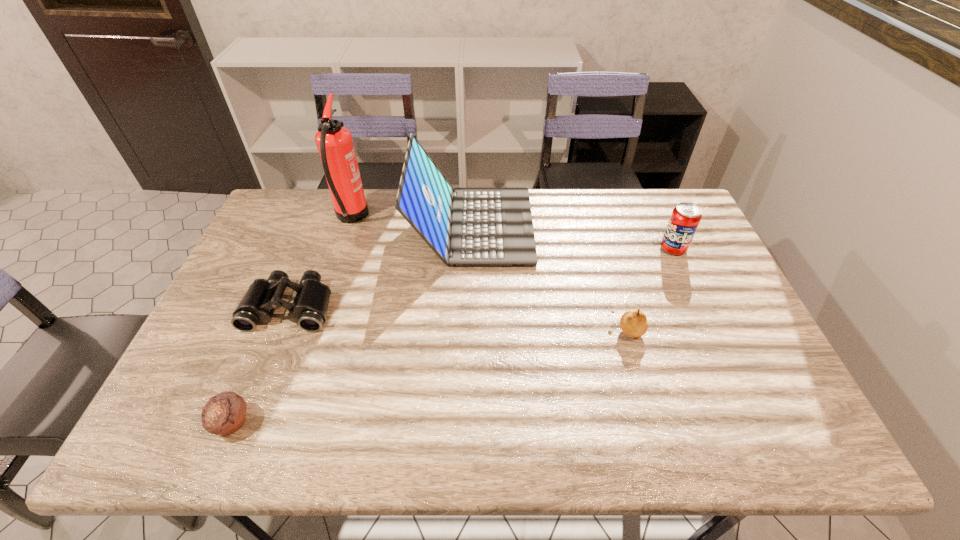
Identify the location of blank space that satisfies the following two spatial constraints: 1. at the nozzle of the tallest object; 2. on the front side of the nearest object. The image size is (960, 540). (285, 423).